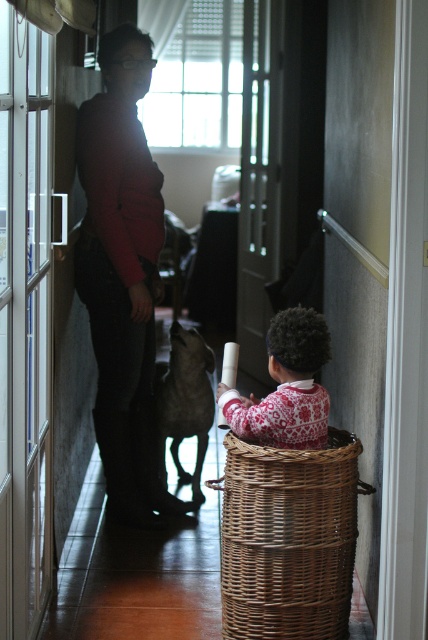
You are trying to decide whether to place a new decorative item in the hallway. The woven brown basket at lower right and the red and white sweater at center are already there. Which object has a greater width?

The woven brown basket at lower right has a greater width than the red and white sweater at center according to the description.

You are trying to decide which sweater to take for a trip. Both the matte red sweater at center and the red and white sweater at center are in the hallway. If you want to wear the wider one, which one should you choose?

Result: The matte red sweater at center might be wider than the red and white sweater at center, so you should choose the matte red sweater at center if you want the wider one.

You are standing in the hallway and see the point at coordinates [122,276]. What object is this point located on?

The point at coordinates [122,276] is located on the matte red sweater at center.